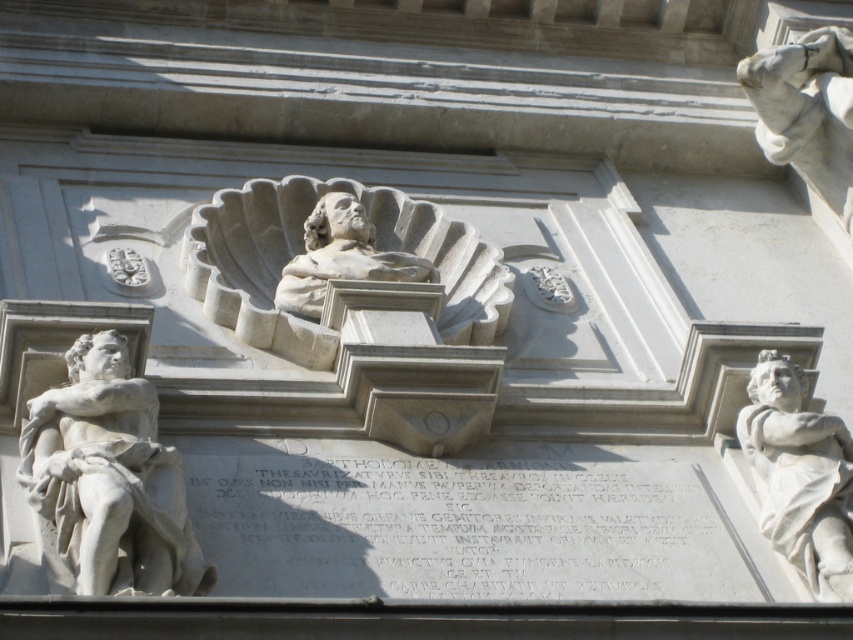
Who is more forward, (850, 547) or (752, 81)?

Point (850, 547)

Is the position of white marble statue at right more distant than that of white marble hand at upper right?

No, white marble statue at right is in front of white marble hand at upper right.

This screenshot has height=640, width=853. In order to click on white marble statue at right in this screenshot , I will do `click(799, 476)`.

Can you confirm if white marble statue at left is positioned to the right of white marble statue at right?

No, white marble statue at left is not to the right of white marble statue at right.

Does white marble statue at left appear on the left side of white marble statue at right?

Correct, you'll find white marble statue at left to the left of white marble statue at right.

Who is more forward, [88,412] or [840,500]?

Answer: Point [88,412] is more forward.

The width and height of the screenshot is (853, 640). I want to click on white marble statue at left, so click(x=109, y=477).

Does white marble statue at left come behind white marble hand at upper right?

No, it is in front of white marble hand at upper right.

Is point (90, 380) closer to viewer compared to point (828, 72)?

Yes, it is in front of point (828, 72).

In the scene shown: Who is more distant from viewer, (x=53, y=445) or (x=840, y=212)?

Point (x=840, y=212)

The width and height of the screenshot is (853, 640). What are the coordinates of `white marble statue at left` in the screenshot? It's located at (109, 477).